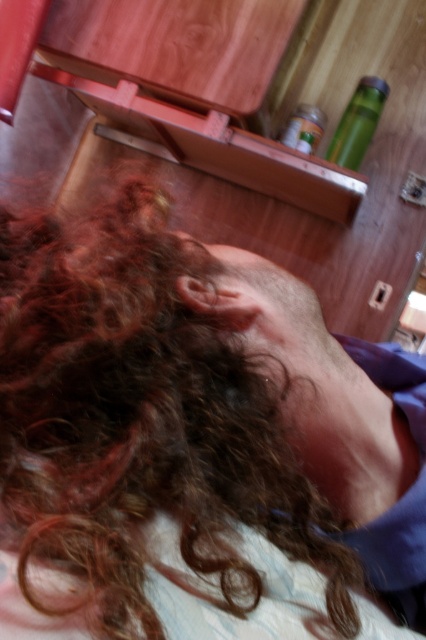
You are a photographer adjusting the lighting in the room. You notice the curly brown hair at center and the green matte bottle at upper right. Which object is closer to the light source?

The green matte bottle at upper right is closer to the light source because it is positioned above the curly brown hair at center, which is under it.

Looking at this image, you are a photographer adjusting your camera to focus on two specific points in the scene. The first point is at coordinates point (83,275), and the second is at point (377,92). Based on the scene description, which point is closer to the camera?

Point (83,275) is in front of point (377,92), so the first point is closer to the camera.

In the scene shown: You are a photographer setting up a close shot of a person. You have to decide if the curly brown hair at center will fit within the frame if you focus on the green matte bottle at upper right. Can you determine this based on their sizes?

The curly brown hair at center is wider than the green matte bottle at upper right, so focusing on the green matte bottle at upper right might not capture the full width of the curly brown hair at center within the frame.